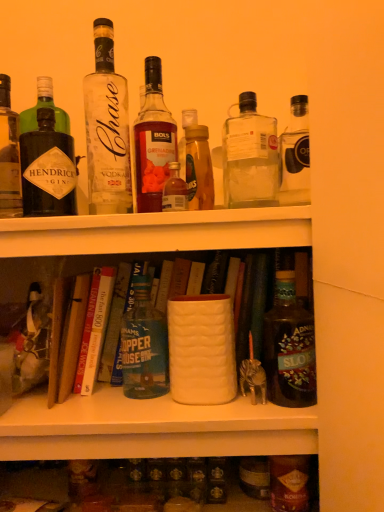
Question: Considering the positions of point (87, 385) and point (72, 321), is point (87, 385) closer or farther from the camera than point (72, 321)?

Choices:
 (A) closer
 (B) farther

Answer: (B)

Question: From the image's perspective, is hardcover book at center, the 2th book positioned from the right, positioned above or below hardcover book at center, placed as the first book when sorted from left to right?

Choices:
 (A) below
 (B) above

Answer: (B)

Question: Estimate the real-world distances between objects in this image. Which object is farther from the dark brown glass bottle at right, acting as the 1th bottle starting from the right?

Choices:
 (A) clear glass bottle at upper center, the 2th bottle when ordered from left to right
 (B) matte black gin bottle at left, which appears as the 8th bottle when viewed from the right
 (C) hardcover book at center, placed as the third book when sorted from right to left
 (D) green glass bottle at center, which is the 6th bottle from right to left
 (E) clear glass bottle at upper center, acting as the 6th bottle starting from the left

Answer: (B)

Question: Based on their relative distances, which object is farther from the matte black gin bottle at left, which appears as the 8th bottle when viewed from the right?

Choices:
 (A) hardcover book at center, acting as the second book starting from the left
 (B) hardcover book at center, the third book in the left-to-right sequence
 (C) hardcover book at center, placed as the third book when sorted from right to left
 (D) clear glass bottle at upper center, marked as the 3th bottle in a right-to-left arrangement
 (E) matte white vase at center

Answer: (D)